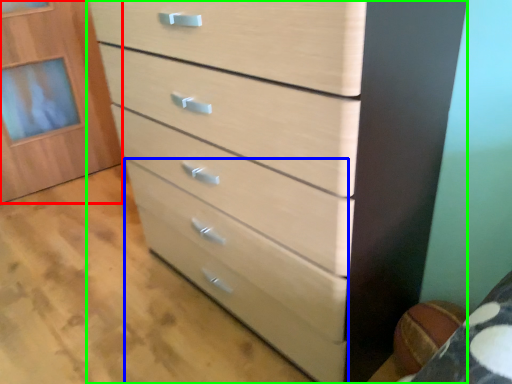
Question: Which object is the farthest from cabinetry (highlighted by a red box)? Choose among these: drawer (highlighted by a blue box) or chest of drawers (highlighted by a green box).

Choices:
 (A) drawer
 (B) chest of drawers

Answer: (B)